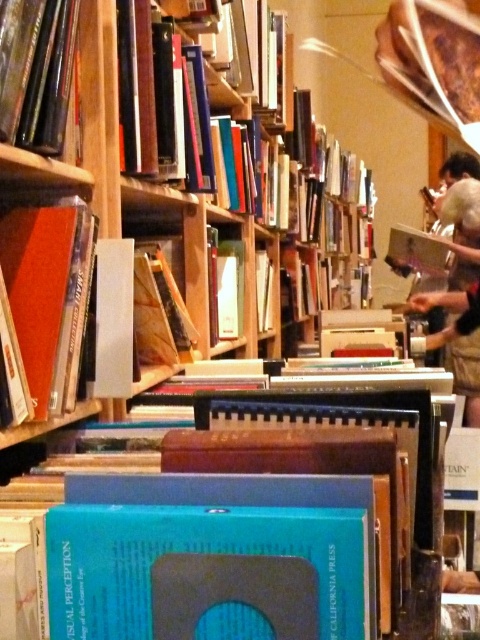
You are a customer in the bookstore looking for a specific book. You see the matte orange book at left and the hardcover book at center. Which book is positioned closer to the left side of the shelf?

The matte orange book at left is positioned closer to the left side of the shelf because it is to the left of the hardcover book at center.

You are navigating through the bookstore and want to reach the blue book with a circular design in the foreground. You are currently at point (64,228). Is the blue book located behind or in front of point (225,280)?

The blue book with a circular design is located in front of point (225,280) because point (64,228) is in front of point (225,280), and you are at point (64,228).